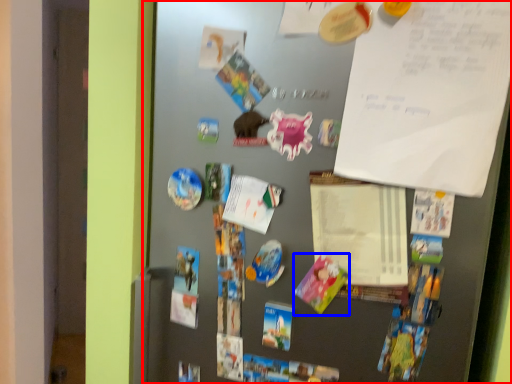
Question: Which object is further to the camera taking this photo, fridge (highlighted by a red box) or postcard (highlighted by a blue box)?

Choices:
 (A) fridge
 (B) postcard

Answer: (B)